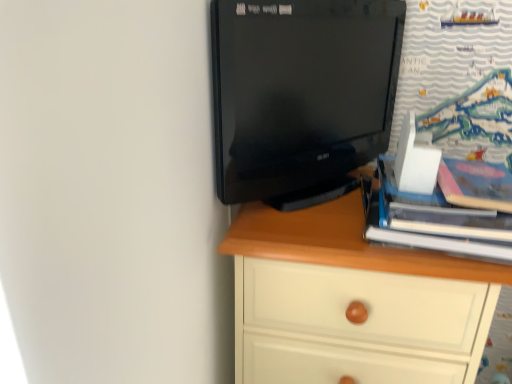
Question: Considering their positions, is black glossy monitor at upper center located in front of or behind hardcover book at right?

Choices:
 (A) front
 (B) behind

Answer: (A)

Question: Considering the positions of black glossy monitor at upper center and hardcover book at right in the image, is black glossy monitor at upper center bigger or smaller than hardcover book at right?

Choices:
 (A) big
 (B) small

Answer: (A)

Question: Based on their relative distances, which object is farther from the black glossy monitor at upper center?

Choices:
 (A) white wood chest of drawers at center
 (B) hardcover book at right

Answer: (B)

Question: Based on their relative distances, which object is farther from the black glossy monitor at upper center?

Choices:
 (A) white wood chest of drawers at center
 (B) hardcover book at right

Answer: (B)